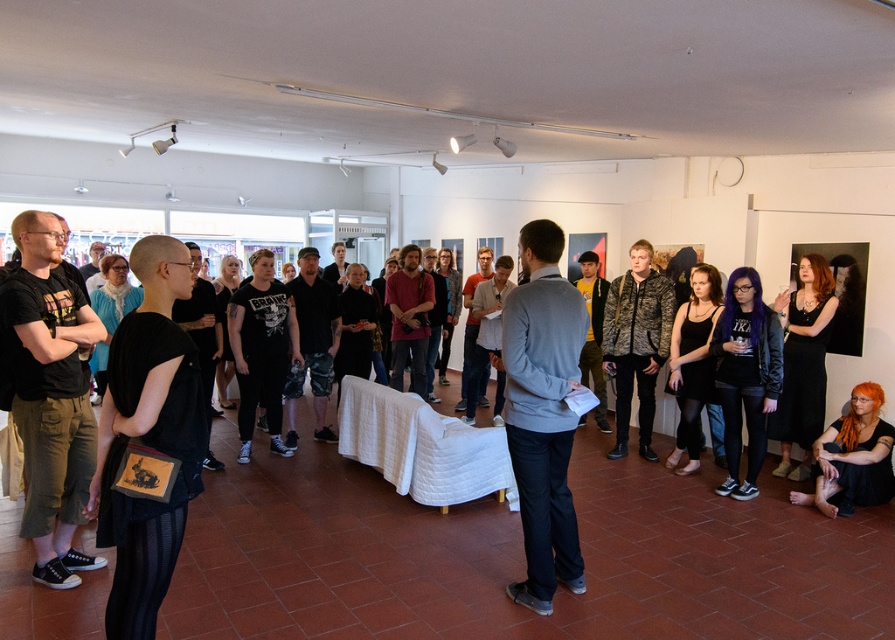
Question: Does gray sweater at center appear on the right side of orange hair at lower right?

Choices:
 (A) no
 (B) yes

Answer: (A)

Question: Which object appears farthest from the camera in this image?

Choices:
 (A) gray sweater at center
 (B) orange hair at lower right

Answer: (B)

Question: Is gray sweater at center below orange hair at lower right?

Choices:
 (A) yes
 (B) no

Answer: (B)

Question: Does gray sweater at center have a lesser width compared to orange hair at lower right?

Choices:
 (A) no
 (B) yes

Answer: (B)